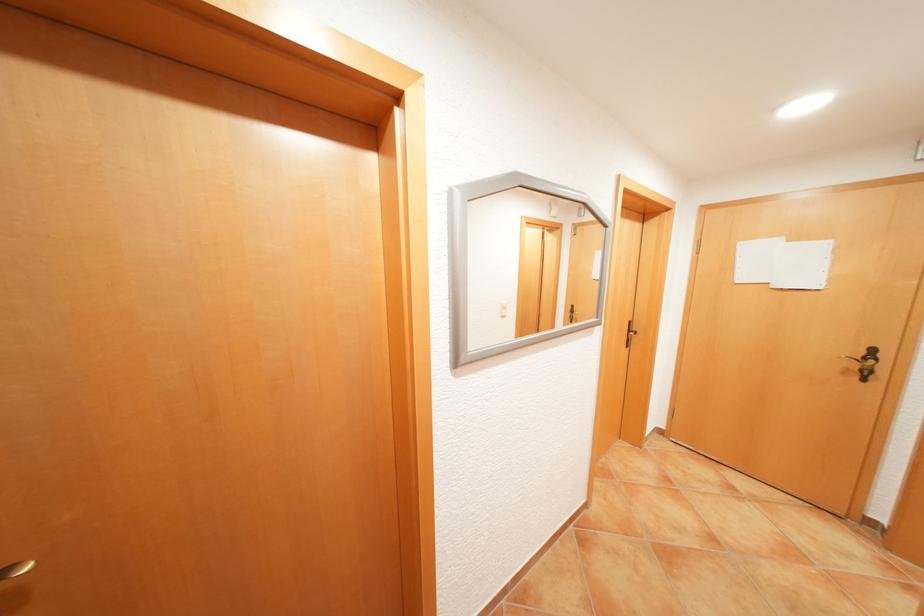
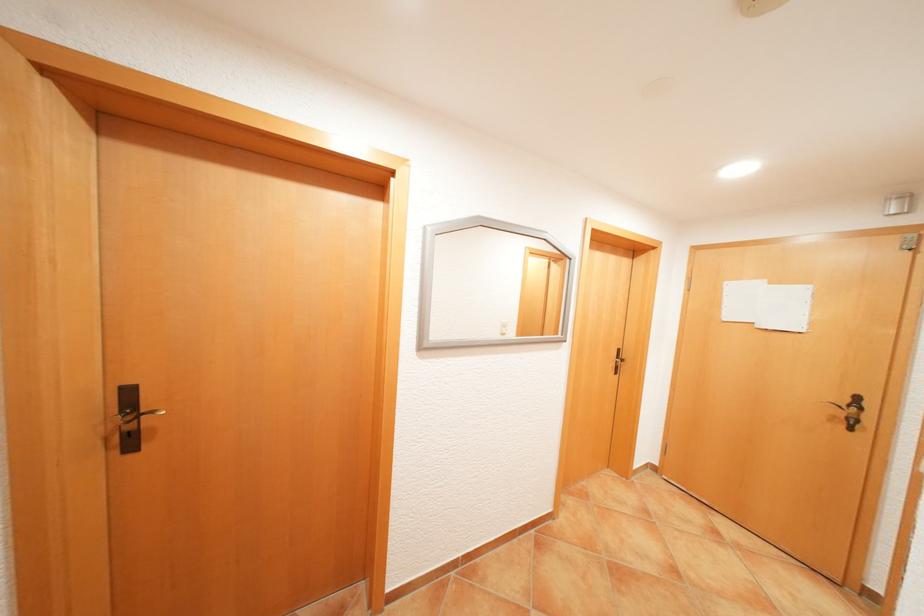
Question: The camera is either moving clockwise (left) or counter-clockwise (right) around the object. The first image is from the beginning of the video and the second image is from the end. Is the camera moving left or right when shooting the video?

Choices:
 (A) Left
 (B) Right

Answer: (B)